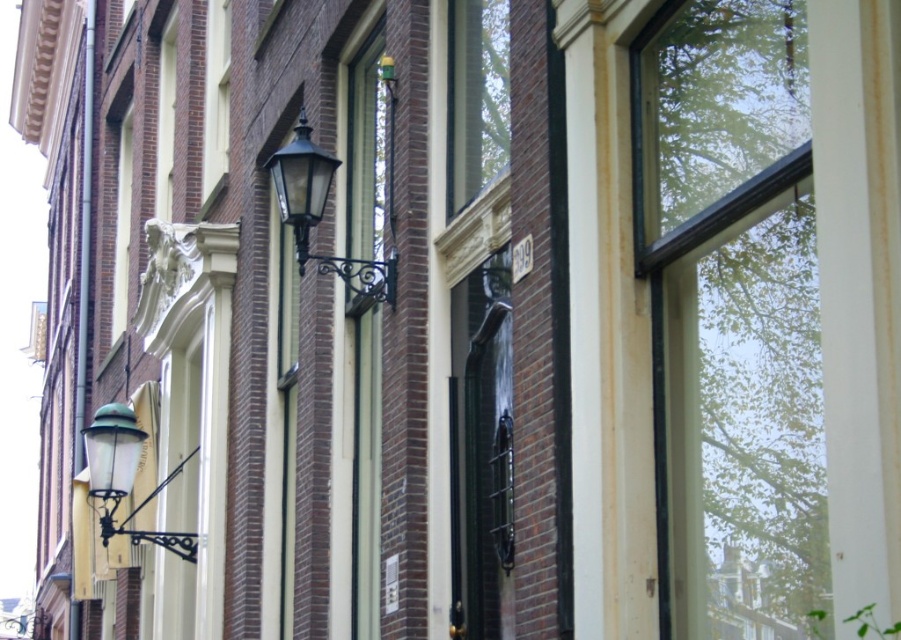
Is matte black lantern at upper center shorter than green glass lamp at upper left?

Yes.

Describe the element at coordinates (321, 214) in the screenshot. I see `matte black lantern at upper center` at that location.

Locate an element on the screen. The height and width of the screenshot is (640, 901). matte black lantern at upper center is located at coordinates (321, 214).